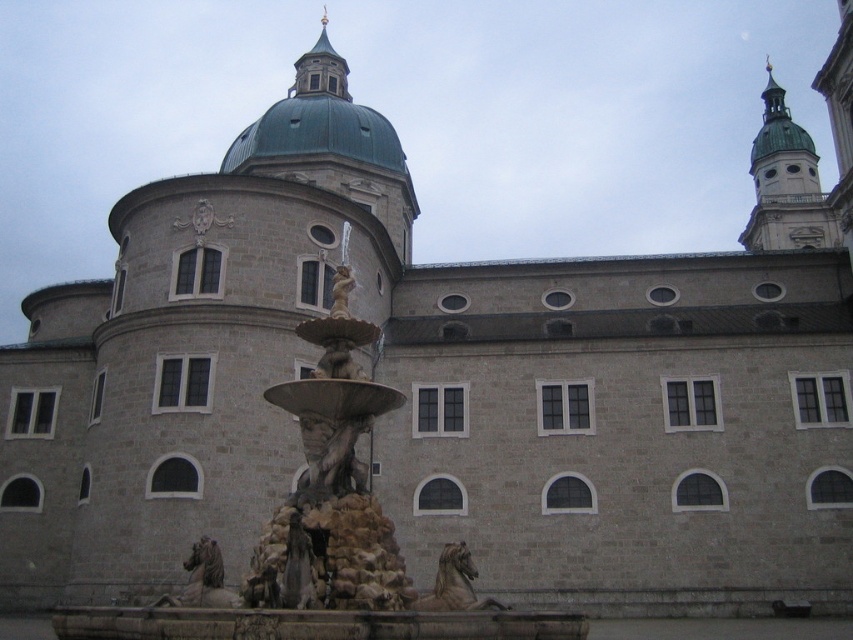
Does green metallic dome at upper center have a greater width compared to polished bronze horse at lower center?

Yes, green metallic dome at upper center is wider than polished bronze horse at lower center.

Who is more forward, (325, 150) or (462, 593)?

Positioned in front is point (462, 593).

Image resolution: width=853 pixels, height=640 pixels. Identify the location of green metallic dome at upper center. (318, 120).

Does stone sculpture fountain at center have a lesser height compared to matte stone statue at center?

No.

Is stone sculpture fountain at center thinner than matte stone statue at center?

Incorrect, stone sculpture fountain at center's width is not less than matte stone statue at center's.

Which is behind, point (213, 595) or point (340, 294)?

Point (340, 294)

I want to click on stone sculpture fountain at center, so [315, 540].

Image resolution: width=853 pixels, height=640 pixels. Describe the element at coordinates (454, 582) in the screenshot. I see `polished bronze horse at lower center` at that location.

Which is behind, point (431, 593) or point (341, 273)?

Positioned behind is point (431, 593).

This screenshot has width=853, height=640. In order to click on polished bronze horse at lower center in this screenshot , I will do `click(454, 582)`.